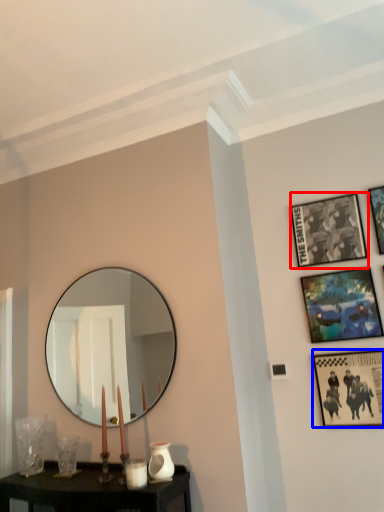
Question: Which object appears farthest to the camera in this image, picture frame (highlighted by a red box) or picture frame (highlighted by a blue box)?

Choices:
 (A) picture frame
 (B) picture frame

Answer: (A)